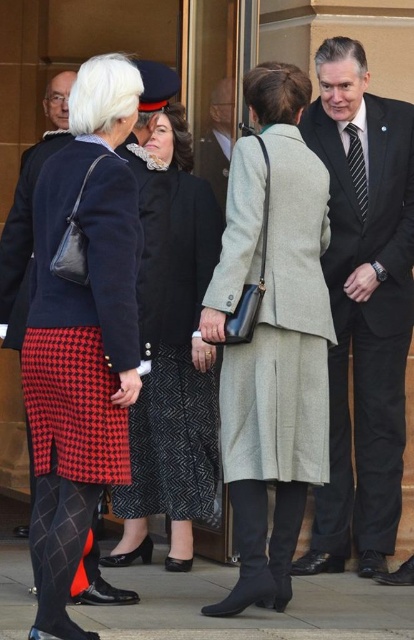
Question: Which object appears closest to the camera in this image?

Choices:
 (A) red houndstooth skirt at lower left
 (B) dark gray suit at center
 (C) black silk suit at center
 (D) striped silk tie at center

Answer: (A)

Question: Which point is closer to the camera taking this photo?

Choices:
 (A) (57, 440)
 (B) (117, 564)

Answer: (A)

Question: Which point is closer to the camera?

Choices:
 (A) (33, 520)
 (B) (2, 237)
 (C) (296, 465)
 (D) (122, 483)

Answer: (D)

Question: Does red houndstooth skirt at lower left appear over matte black sweater at center?

Choices:
 (A) no
 (B) yes

Answer: (A)

Question: Can you confirm if black silk suit at center is positioned to the left of striped silk tie at center?

Choices:
 (A) yes
 (B) no

Answer: (A)

Question: Can you confirm if dark gray suit at center is smaller than striped silk tie at center?

Choices:
 (A) yes
 (B) no

Answer: (B)